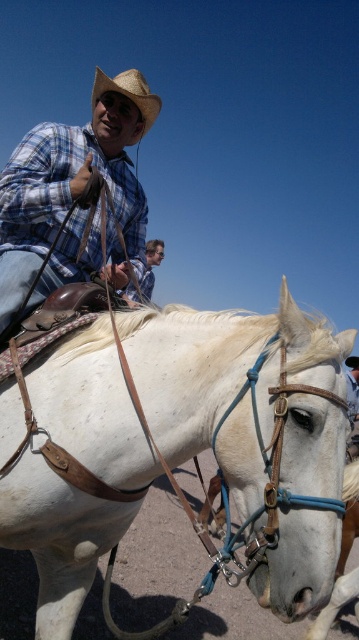
Question: Is plaid cotton shirt at upper left bigger than straw hat at upper center?

Choices:
 (A) yes
 (B) no

Answer: (B)

Question: Does plaid cotton shirt at upper left appear over light brown leather belt at upper center?

Choices:
 (A) no
 (B) yes

Answer: (A)

Question: Which object appears closest to the camera in this image?

Choices:
 (A) straw hat at upper center
 (B) light brown leather belt at upper center
 (C) plaid cotton shirt at upper left

Answer: (C)

Question: Based on their relative distances, which object is nearer to the plaid cotton shirt at upper left?

Choices:
 (A) light brown leather belt at upper center
 (B) straw hat at upper center
 (C) white leather horse at center

Answer: (B)

Question: Which point is closer to the camera?

Choices:
 (A) straw hat at upper center
 (B) light brown leather belt at upper center

Answer: (B)

Question: Is white leather horse at center above straw hat at upper center?

Choices:
 (A) no
 (B) yes

Answer: (A)